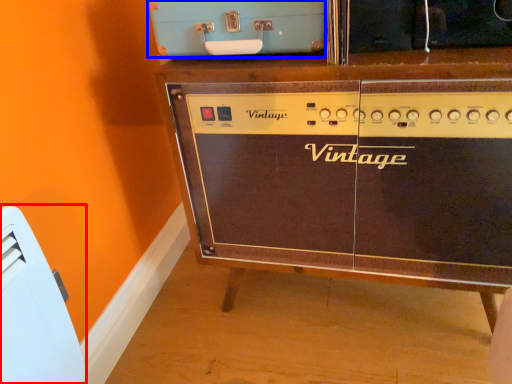
Question: Which object is further to the camera taking this photo, appliance (highlighted by a red box) or appliance (highlighted by a blue box)?

Choices:
 (A) appliance
 (B) appliance

Answer: (B)